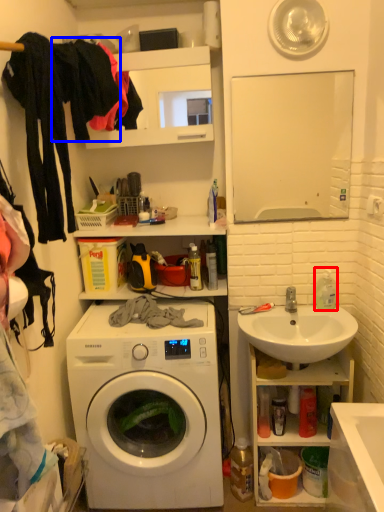
Question: Which of the following is the farthest to the observer, cleaning product (highlighted by a red box) or clothing (highlighted by a blue box)?

Choices:
 (A) cleaning product
 (B) clothing

Answer: (A)